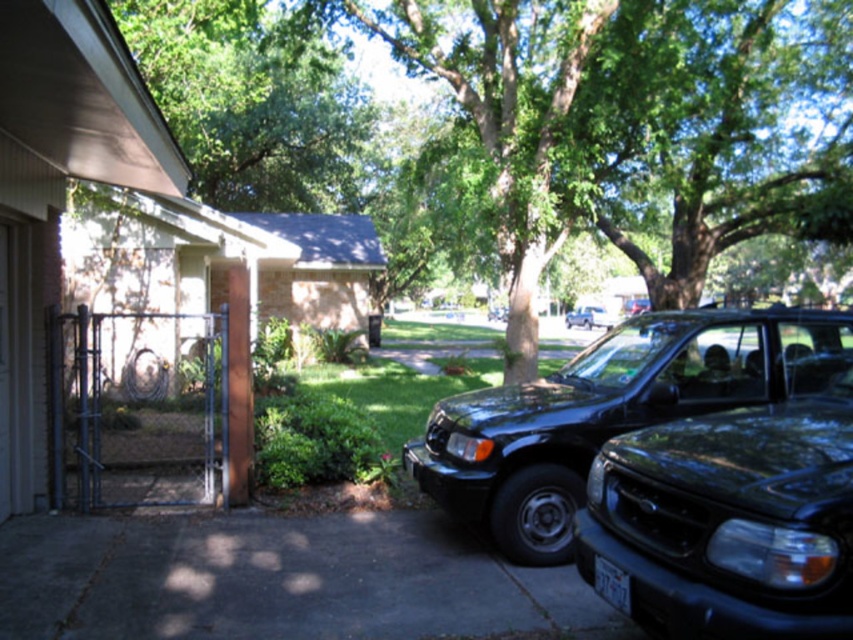
Question: Does green leafy tree at upper left have a lesser width compared to white plastic license plate at center?

Choices:
 (A) yes
 (B) no

Answer: (B)

Question: Which point is closer to the camera?

Choices:
 (A) (602, 308)
 (B) (633, 456)
 (C) (206, 557)
 (D) (607, 592)

Answer: (D)

Question: Can you confirm if green leafy tree at center is thinner than glossy black suv at center?

Choices:
 (A) no
 (B) yes

Answer: (A)

Question: Which point is farther to the camera?

Choices:
 (A) green leafy tree at center
 (B) white plastic license plate at center
 (C) shiny black suv at center
 (D) gray concrete pavement at lower center

Answer: (C)

Question: Which point is closer to the camera taking this photo?

Choices:
 (A) click(741, 628)
 (B) click(743, 340)
 (C) click(577, 312)

Answer: (A)

Question: Does gray concrete pavement at lower center have a larger size compared to glossy black suv at center?

Choices:
 (A) no
 (B) yes

Answer: (A)